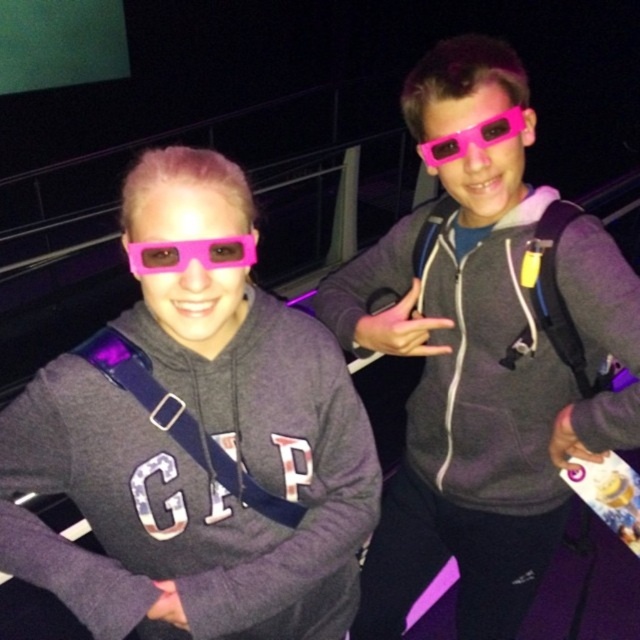
You are a movie theater employee who needs to place a 30 inch wide advertisement on the wall behind the matte pink glasses at center. Can you fit the advertisement there?

The matte pink glasses at center are 30.17 inches away from the viewer. Since the advertisement is 30 inches wide, it can fit as it is slightly narrower than the distance available.

From the picture: You are at a movie theater and see two people wearing pink 3D glasses. There is a specific point marked at coordinates (196, 472). What object is located at that point?

The point at (196, 472) marks the matte pink glasses at center.

Based on the photo, you are trying to locate the matte gray hoodie at center in the image. According to the coordinates provided, where exactly is it positioned?

The matte gray hoodie at center is located at point coordinates of 0.577 on the x axis and 0.734 on the y axis.